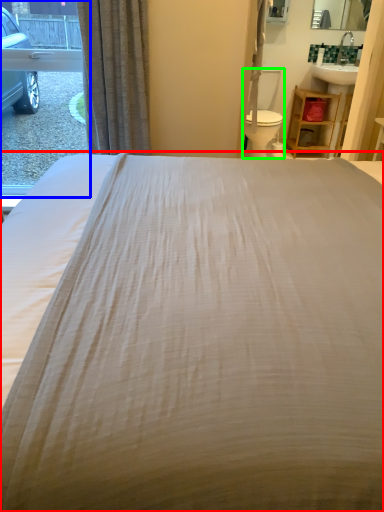
Question: Which object is the farthest from bed (highlighted by a red box)? Choose among these: window (highlighted by a blue box) or swivel chair (highlighted by a green box).

Choices:
 (A) window
 (B) swivel chair

Answer: (A)